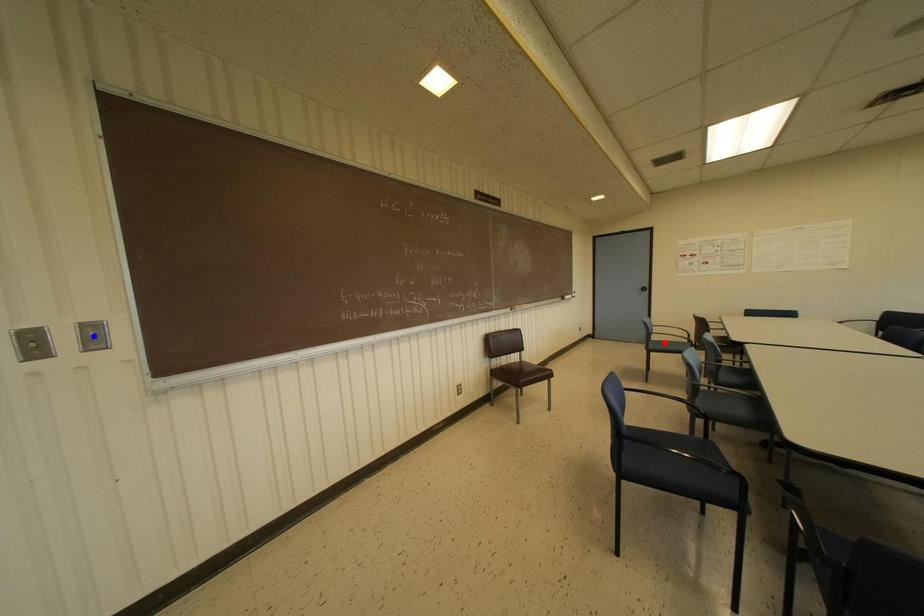
Question: Which of the two points in the image is closer to the camera?

Choices:
 (A) Blue point is closer.
 (B) Red point is closer.

Answer: (A)